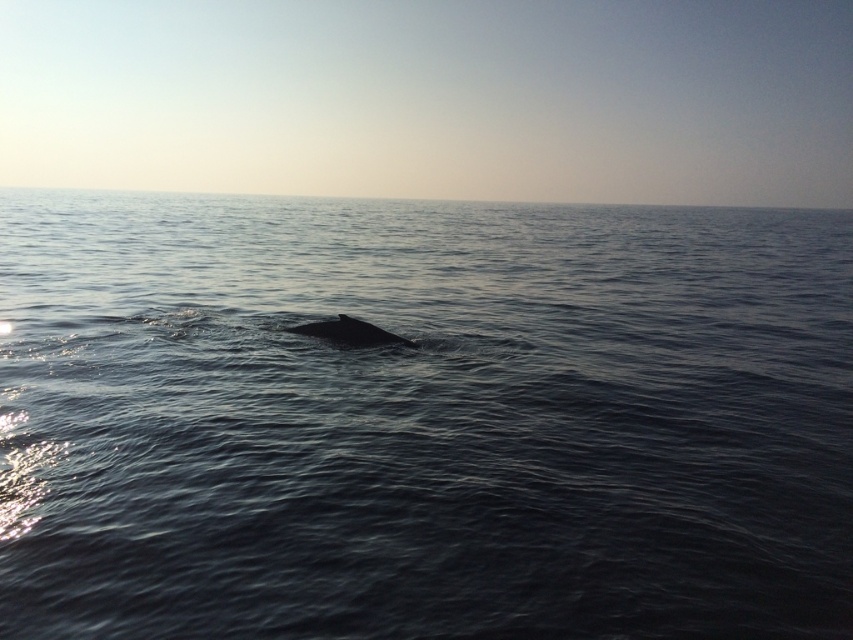
You are a marine biologist observing the ocean scene. You notice the dark blue water at center and the gray matte whale at center. Based on their positions, which one is closer to the surface of the water?

The dark blue water at center is positioned over the gray matte whale at center, meaning the dark blue water at center is closer to the surface.

You are a marine biologist studying ocean currents. You observe the dark blue water at center in the image. Based on its position, can you determine if it is located closer to the top or bottom of the image?

The dark blue water at center is positioned at point 0.658 on the vertical axis, which places it closer to the bottom of the image since the vertical coordinate ranges from 0 at the top to 1 at the bottom.